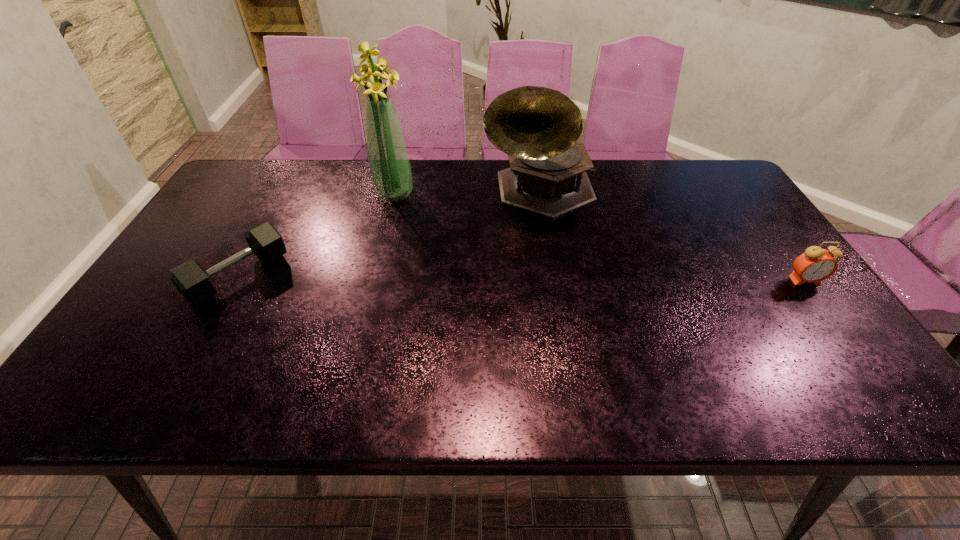
Image resolution: width=960 pixels, height=540 pixels. I want to click on the shortest object, so click(195, 284).

The height and width of the screenshot is (540, 960). In order to click on dumbbell in this screenshot , I will do `click(195, 284)`.

Where is `the second shortest object`? the second shortest object is located at coordinates (815, 265).

You are a GUI agent. You are given a task and a screenshot of the screen. Output one action in this format:
    pyautogui.click(x=<x>, y=<y>)
    Task: Click on the rightmost object
    
    Given the screenshot: What is the action you would take?
    pyautogui.click(x=815, y=265)

Where is `the tallest object`? The width and height of the screenshot is (960, 540). the tallest object is located at coordinates (389, 167).

Locate an element on the screen. the third object from right to left is located at coordinates point(389,167).

Where is `phonograph record`? phonograph record is located at coordinates (538, 127).

Find the location of a particular element. the second tallest object is located at coordinates (538, 127).

Image resolution: width=960 pixels, height=540 pixels. Identify the location of vacant space situated on the right of the dumbbell. (376, 276).

Where is `vacant area located 0.060m on the face of the second shortest object`? The height and width of the screenshot is (540, 960). vacant area located 0.060m on the face of the second shortest object is located at coordinates (822, 304).